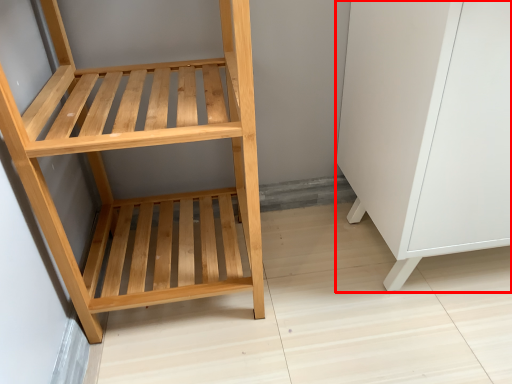
Question: From the image's perspective, where is file cabinet (annotated by the red box) located relative to furniture?

Choices:
 (A) above
 (B) below

Answer: (A)